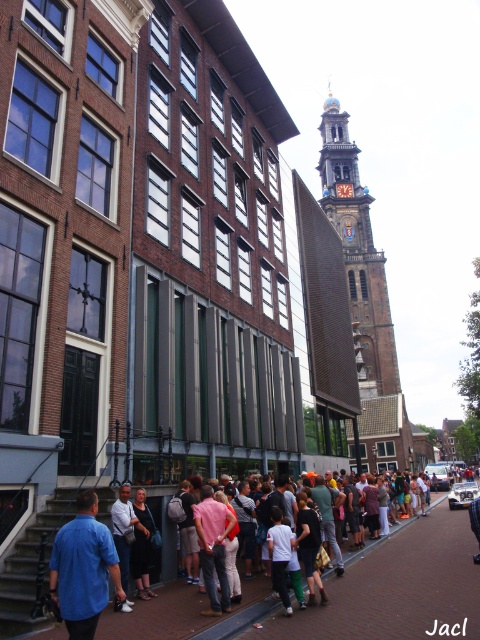
Is brown brick clock tower at upper center smaller than pink fabric shirt at center?

Actually, brown brick clock tower at upper center might be larger than pink fabric shirt at center.

This screenshot has height=640, width=480. Describe the element at coordinates (358, 253) in the screenshot. I see `brown brick clock tower at upper center` at that location.

This screenshot has width=480, height=640. In order to click on brown brick clock tower at upper center in this screenshot , I will do `click(358, 253)`.

Between brick pavement at lower center and blue shirt at lower left, which one is positioned higher?

blue shirt at lower left

Can you confirm if brick pavement at lower center is shorter than blue shirt at lower left?

No, brick pavement at lower center is not shorter than blue shirt at lower left.

Is point (421, 605) closer to viewer compared to point (104, 563)?

No, it is behind (104, 563).

Find the location of a particular element. This screenshot has width=480, height=640. brick pavement at lower center is located at coordinates (394, 588).

Where is `brick pavement at lower center`? The height and width of the screenshot is (640, 480). brick pavement at lower center is located at coordinates (394, 588).

Identify the location of brick pavement at lower center. The image size is (480, 640). click(394, 588).

I want to click on brick pavement at lower center, so click(394, 588).